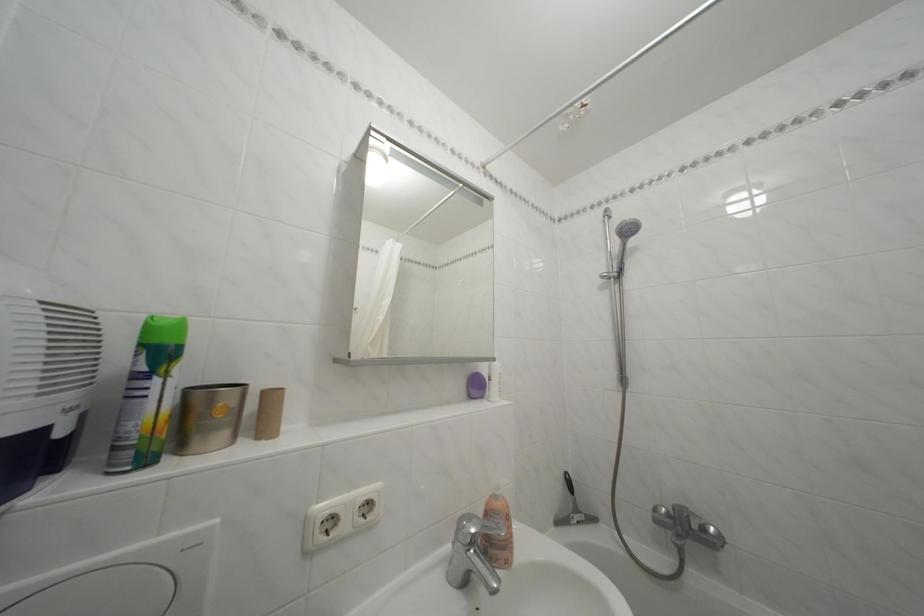
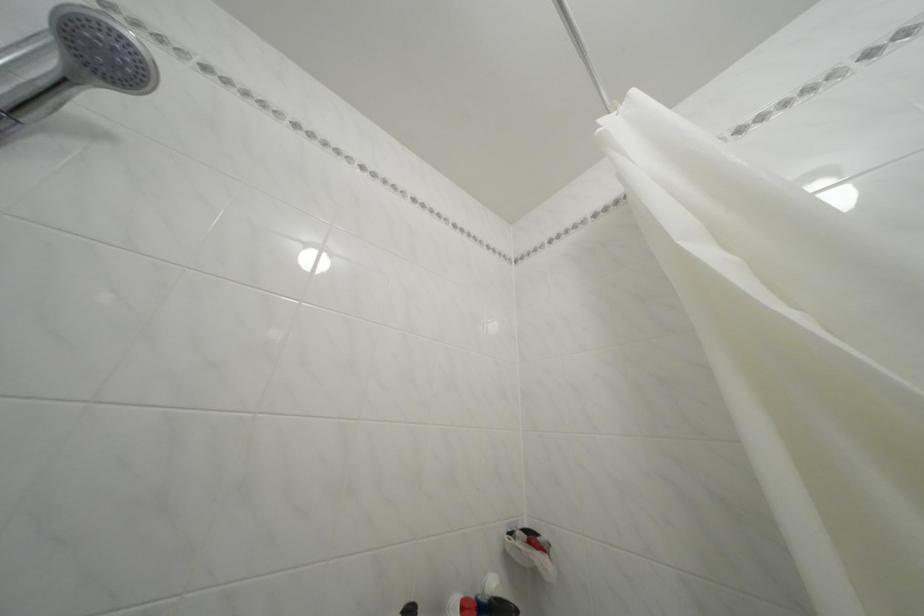
First-person continuous shooting, in which direction is the camera rotating?

The rotation direction of the camera is right-up.